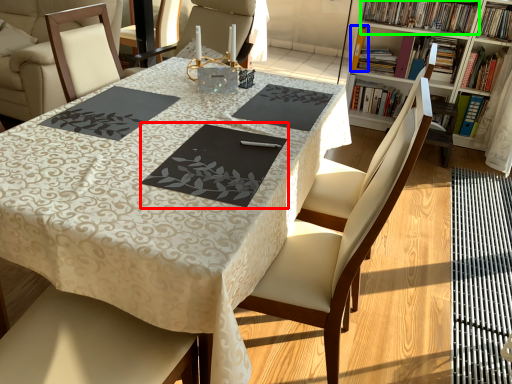
Question: Which object is the farthest from place mat (highlighted by a red box)? Choose among these: book (highlighted by a blue box) or book (highlighted by a green box).

Choices:
 (A) book
 (B) book

Answer: (A)